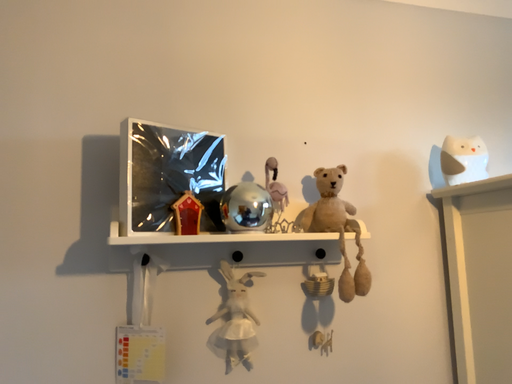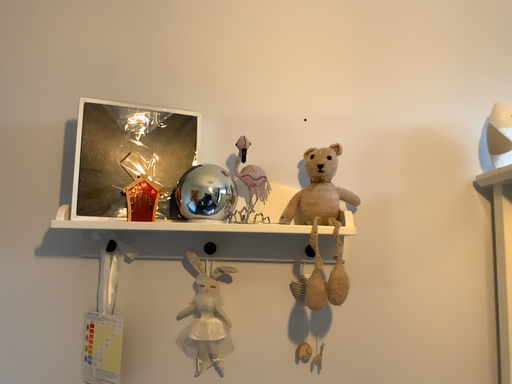
Question: How did the camera likely rotate when shooting the video?

Choices:
 (A) rotated left
 (B) rotated right

Answer: (A)